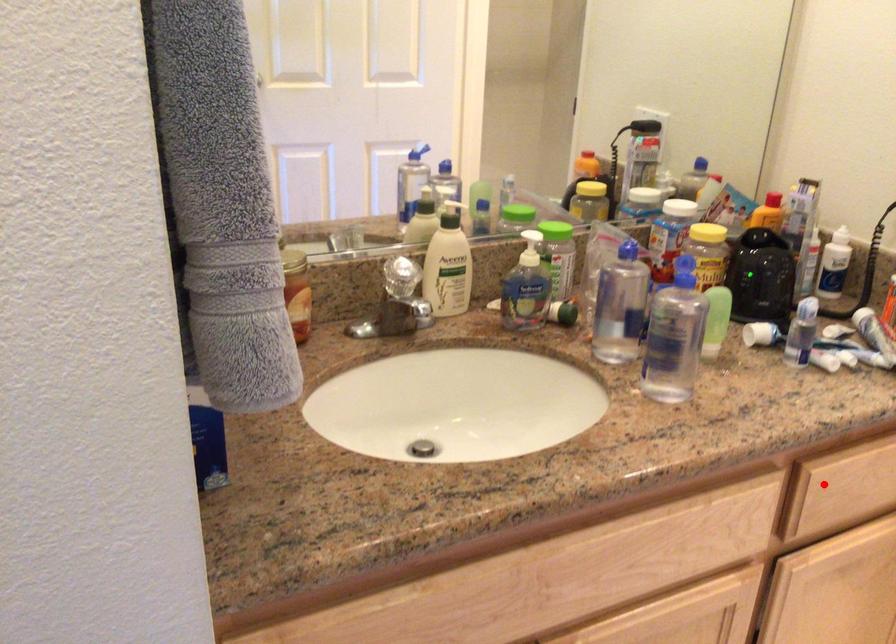
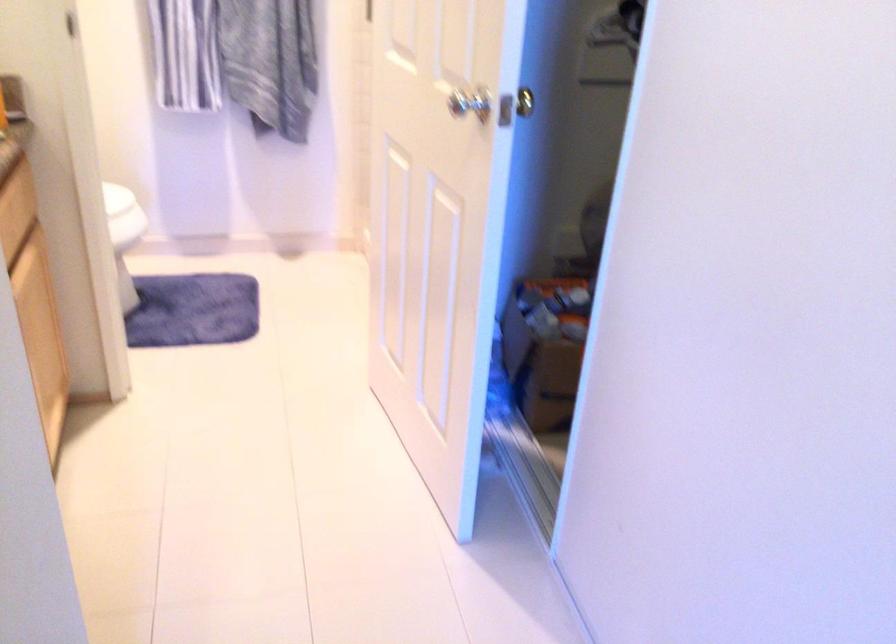
Locate, in the second image, the point that corresponds to the highlighted location in the first image.

(12, 229)